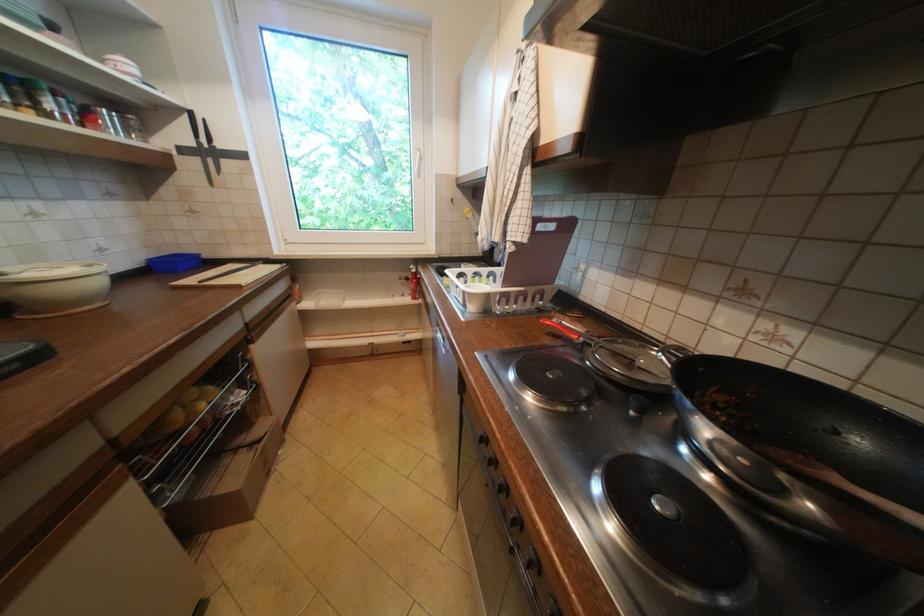
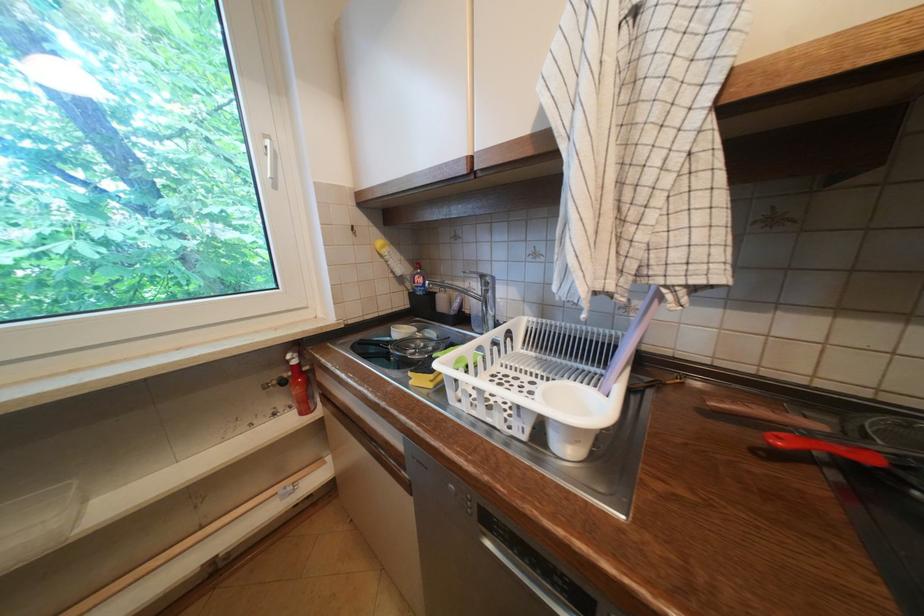
Where in the second image is the point corresponding to [419,270] from the first image?

(296, 362)